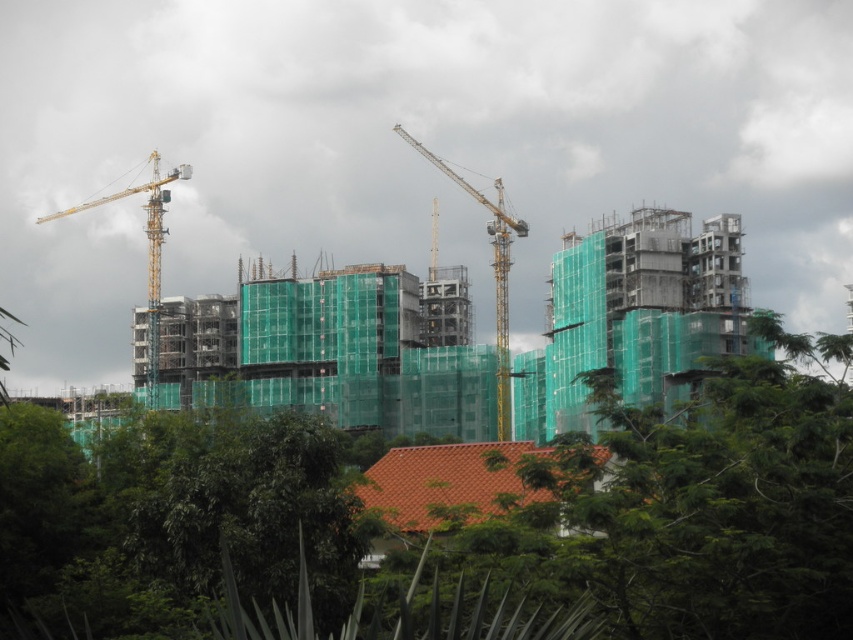
Who is lower down, green leafy tree at center or yellow metallic crane at left?

green leafy tree at center

Can you confirm if green leafy tree at center is bigger than yellow metallic crane at left?

Indeed, green leafy tree at center has a larger size compared to yellow metallic crane at left.

Is point (225, 604) less distant than point (154, 308)?

Yes.

This screenshot has height=640, width=853. I want to click on green leafy tree at center, so click(440, 520).

Does green leafy tree at center come behind yellow metallic crane at center?

No, green leafy tree at center is closer to the viewer.

Between point (428, 611) and point (497, 307), which one is positioned behind?

Point (497, 307)

Is point (738, 577) less distant than point (506, 385)?

That is True.

The image size is (853, 640). In order to click on green leafy tree at center in this screenshot , I will do `click(440, 520)`.

Is yellow metallic crane at center shorter than yellow metallic crane at left?

No, yellow metallic crane at center is not shorter than yellow metallic crane at left.

Is yellow metallic crane at center bigger than yellow metallic crane at left?

No, yellow metallic crane at center is not bigger than yellow metallic crane at left.

Which is in front, point (444, 172) or point (154, 205)?

Positioned in front is point (444, 172).

I want to click on yellow metallic crane at center, so click(492, 273).